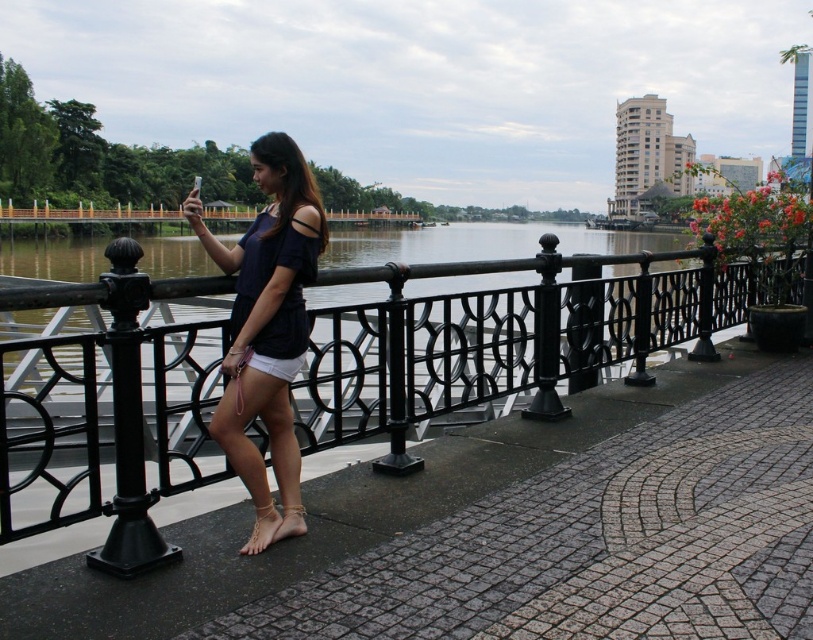
Which of these two, black wrought iron fence at center or clear plastic anklet at lower center, stands shorter?

With less height is clear plastic anklet at lower center.

Can you confirm if black wrought iron fence at center is bigger than clear plastic anklet at lower center?

Indeed, black wrought iron fence at center has a larger size compared to clear plastic anklet at lower center.

Who is more distant from viewer, (794, 289) or (279, 538)?

Point (794, 289)

The height and width of the screenshot is (640, 813). What are the coordinates of `black wrought iron fence at center` in the screenshot? It's located at (496, 342).

Looking at this image, between matte blue top at center and gold metallic anklet at lower center, which one is positioned lower?

gold metallic anklet at lower center

Is point (262, 472) farther from camera compared to point (272, 528)?

That is True.

What do you see at coordinates (266, 312) in the screenshot?
I see `matte blue top at center` at bounding box center [266, 312].

Identify the location of matte blue top at center. (266, 312).

Between black wrought iron fence at center and gold metallic anklet at lower center, which one has less height?

gold metallic anklet at lower center is shorter.

Is point (151, 417) more distant than point (259, 529)?

Yes, point (151, 417) is behind point (259, 529).

Identify the location of black wrought iron fence at center. (496, 342).

Identify the location of black wrought iron fence at center. (496, 342).